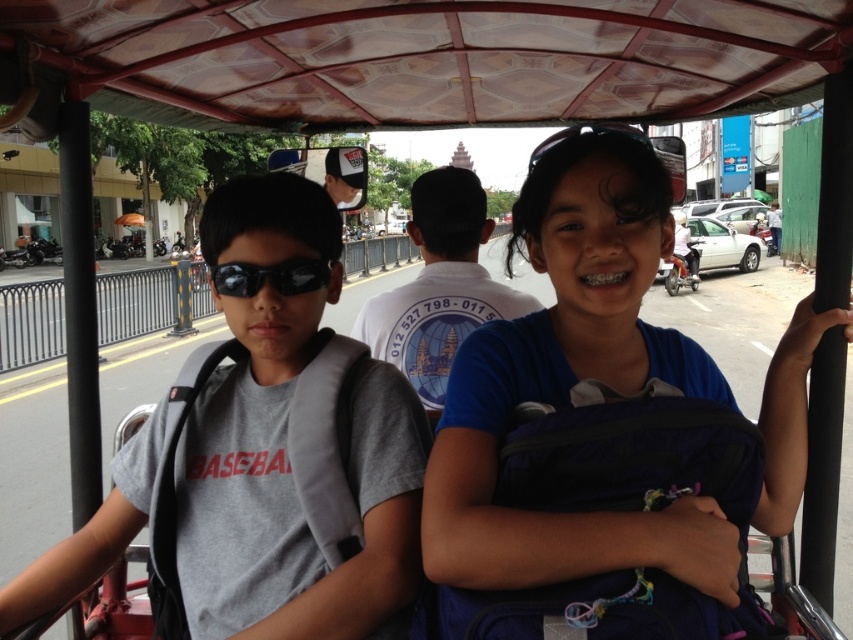
You are a photographer trying to capture a closeup of the black matte sunglasses at center inside the tuk tuk. However, the gray fabric backpack at left is blocking your view. Can you move the backpack to the right to get a clear shot?

The gray fabric backpack at left is to the left of black matte sunglasses at center, so moving it to the right would place it directly in front of the sunglasses, still blocking the view. You need to move the backpack further to the right beyond the sunglasses to clear the path.

You are a passenger in the tuk tuk and want to reach the black matte sunglasses at center without disturbing the blue fabric backpack at center. Is it possible?

The blue fabric backpack at center is located below the black matte sunglasses at center, so you can reach the black matte sunglasses at center by moving your hand above the backpack.